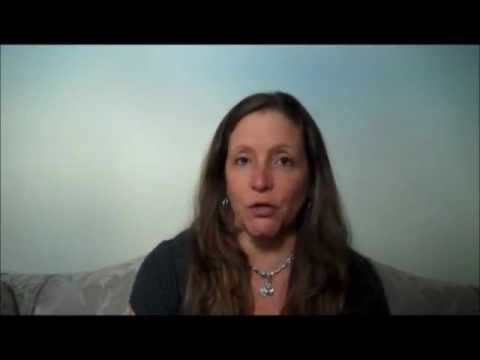
Locate an element on the screen. couch in background is located at coordinates (96, 297).